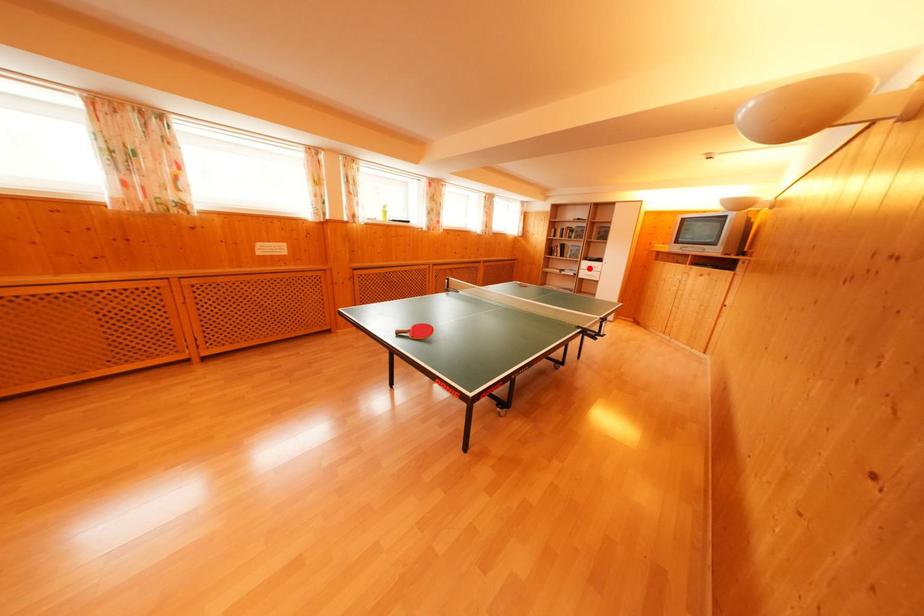
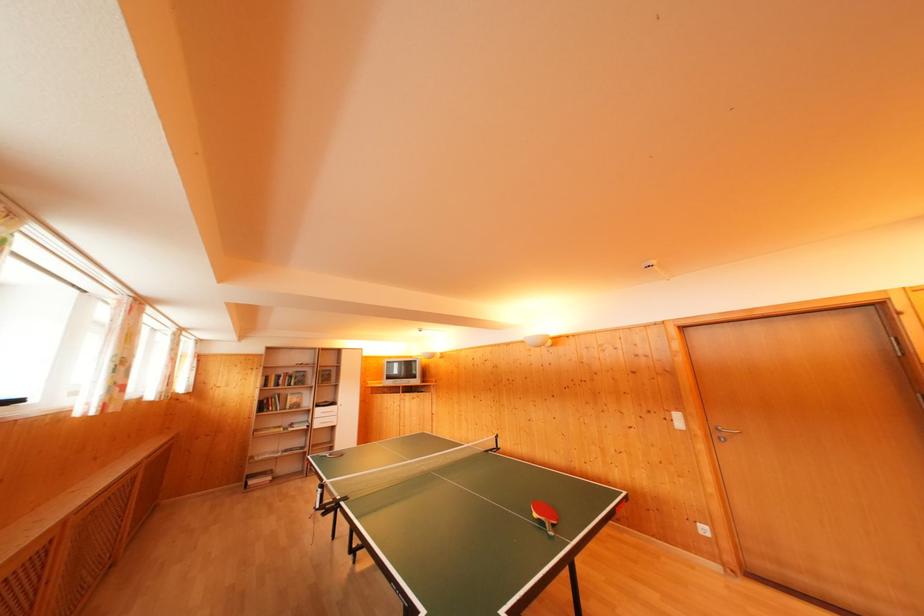
Where in the second image is the point corresponding to the highlighted location from the first image?

(322, 416)